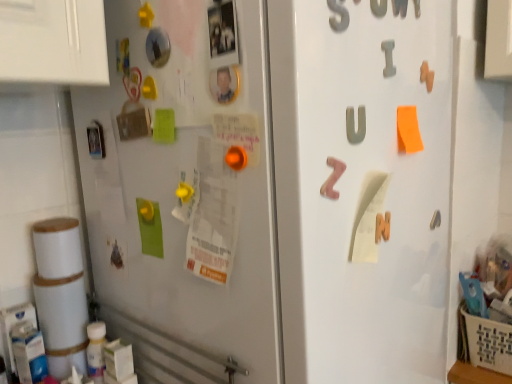
Where is `pink foam letter z at center, the third alphabet when ordered from top to bottom`? This screenshot has width=512, height=384. pink foam letter z at center, the third alphabet when ordered from top to bottom is located at coordinates (333, 178).

Where is `white paper at center right`? white paper at center right is located at coordinates click(x=368, y=217).

What do you see at coordinates (378, 7) in the screenshot? This screenshot has height=384, width=512. I see `metallic gray letter at upper center, positioned as the 2th number in left-to-right order` at bounding box center [378, 7].

Where is `beige woven basket at lower right`? beige woven basket at lower right is located at coordinates (484, 342).

How far apart are white paper at center right and gray matte letter i at upper right, acting as the third alphabet starting from the bottom?

They are 8.14 inches apart.

Is white paper at center right turned away from gray matte letter i at upper right, positioned as the 3th alphabet in front-to-back order?

No.

Can you confirm if white paper at center right is bigger than gray matte letter i at upper right, which is the third alphabet in left-to-right order?

Indeed, white paper at center right has a larger size compared to gray matte letter i at upper right, which is the third alphabet in left-to-right order.

Consider the image. Is there a large distance between white paper at center right and gray matte letter i at upper right, the first alphabet in the back-to-front sequence?

No, white paper at center right is not far away from gray matte letter i at upper right, the first alphabet in the back-to-front sequence.

Which object is further away from the camera, matte gray letter u at center, which is counted as the 2th alphabet, starting from the front, or pink foam letter z at center, the third alphabet when ordered from right to left?

matte gray letter u at center, which is counted as the 2th alphabet, starting from the front, is further from the camera.

Does matte gray letter u at center, the 2th alphabet ordered from the bottom, have a larger size compared to pink foam letter z at center, which is the third alphabet in back-to-front order?

Incorrect, matte gray letter u at center, the 2th alphabet ordered from the bottom, is not larger than pink foam letter z at center, which is the third alphabet in back-to-front order.

From a real-world perspective, who is located higher, matte gray letter u at center, which ranks as the 2th alphabet in right-to-left order, or pink foam letter z at center, the third alphabet when ordered from right to left?

From a 3D spatial view, matte gray letter u at center, which ranks as the 2th alphabet in right-to-left order, is above.

Considering the positions of point (349, 110) and point (370, 253), is point (349, 110) closer or farther from the camera than point (370, 253)?

Point (349, 110).

Is matte gray letter u at center, the second alphabet from the back, not near white paper at center right?

No.

Could you tell me if matte gray letter u at center, the 2th alphabet ordered from the bottom, is turned towards white paper at center right?

No, matte gray letter u at center, the 2th alphabet ordered from the bottom, is not oriented towards white paper at center right.

Image resolution: width=512 pixels, height=384 pixels. Identify the location of the 1st alphabet counting from the left side of the white paper at center right. (354, 125).

Considering the relative sizes of beige woven basket at lower right and pink foam letter z at center, which is the first alphabet in front-to-back order, in the image provided, is beige woven basket at lower right smaller than pink foam letter z at center, which is the first alphabet in front-to-back order,?

No.

Considering the relative positions of beige woven basket at lower right and pink foam letter z at center, the third alphabet when ordered from top to bottom, in the image provided, is beige woven basket at lower right to the left or to the right of pink foam letter z at center, the third alphabet when ordered from top to bottom,?

Based on their positions, beige woven basket at lower right is located to the right of pink foam letter z at center, the third alphabet when ordered from top to bottom.

Considering the relative sizes of beige woven basket at lower right and pink foam letter z at center, acting as the 1th alphabet starting from the left, in the image provided, is beige woven basket at lower right taller than pink foam letter z at center, acting as the 1th alphabet starting from the left,?

Yes.

Is beige woven basket at lower right facing towards pink foam letter z at center, which is the third alphabet in back-to-front order?

No, beige woven basket at lower right is not facing towards pink foam letter z at center, which is the third alphabet in back-to-front order.

Can you confirm if pink foam letter z at center, acting as the 1th alphabet starting from the left, is smaller than metallic gray letter at upper right, positioned as the second number in right-to-left order?

No.

Who is more distant, pink foam letter z at center, the third alphabet when ordered from right to left, or metallic gray letter at upper right, acting as the second number starting from the back?

pink foam letter z at center, the third alphabet when ordered from right to left, is further away from the camera.

Looking at this image, is pink foam letter z at center, which is the first alphabet in front-to-back order, positioned with its back to metallic gray letter at upper right, acting as the second number starting from the back?

No.

Considering the sizes of objects pink foam letter z at center, the third alphabet when ordered from right to left, and metallic gray letter at upper right, acting as the second number starting from the back, in the image provided, who is thinner, pink foam letter z at center, the third alphabet when ordered from right to left, or metallic gray letter at upper right, acting as the second number starting from the back,?

metallic gray letter at upper right, acting as the second number starting from the back.

Is beige woven basket at lower right wider or thinner than matte gray letter u at center, the second alphabet from the back?

In the image, beige woven basket at lower right appears to be wider than matte gray letter u at center, the second alphabet from the back.

Is beige woven basket at lower right taller than matte gray letter u at center, the second alphabet from the back?

Yes, beige woven basket at lower right is taller than matte gray letter u at center, the second alphabet from the back.

In the scene shown: Would you consider beige woven basket at lower right to be distant from matte gray letter u at center, the 2th alphabet ordered from the bottom?

beige woven basket at lower right is actually quite close to matte gray letter u at center, the 2th alphabet ordered from the bottom.

Image resolution: width=512 pixels, height=384 pixels. I want to click on the 2nd alphabet to the left of the beige woven basket at lower right, counting from the anchor's position, so click(x=354, y=125).

Is metallic gray letter at upper right, which is the 1th number in front-to-back order, bigger or smaller than matte gray letter u at center, which ranks as the 2th alphabet in right-to-left order?

In the image, metallic gray letter at upper right, which is the 1th number in front-to-back order, appears to be larger than matte gray letter u at center, which ranks as the 2th alphabet in right-to-left order.

Is metallic gray letter at upper right, the first number in the left-to-right sequence, with matte gray letter u at center, which is counted as the 2th alphabet, starting from the front?

metallic gray letter at upper right, the first number in the left-to-right sequence, and matte gray letter u at center, which is counted as the 2th alphabet, starting from the front, are not in contact.

Considering the positions of points (342, 20) and (359, 139), is point (342, 20) farther from camera compared to point (359, 139)?

No, it is in front of (359, 139).

From a real-world perspective, is metallic gray letter at upper right, acting as the second number starting from the back, beneath matte gray letter u at center, the 2th alphabet ordered from the bottom?

No, from a real-world perspective, metallic gray letter at upper right, acting as the second number starting from the back, is not under matte gray letter u at center, the 2th alphabet ordered from the bottom.

The image size is (512, 384). In order to click on the 2nd alphabet behind the white paper at center right in this screenshot , I will do `click(388, 58)`.

Find the location of a particular element. Image resolution: width=512 pixels, height=384 pixels. alphabet in front of the matte gray letter u at center, the second alphabet from the back is located at coordinates (333, 178).

Considering their positions, is metallic gray letter at upper center, which is the second number from front to back, positioned closer to metallic gray letter at upper right, which is the 1th number in front-to-back order, than matte gray letter u at center, which is counted as the 2th alphabet, starting from the front?

Based on the image, metallic gray letter at upper center, which is the second number from front to back, appears to be nearer to metallic gray letter at upper right, which is the 1th number in front-to-back order.

From the image, which object appears to be farther from matte gray letter u at center, which ranks as the 2th alphabet in right-to-left order, gray matte letter i at upper right, the first alphabet in the right-to-left sequence, or metallic gray letter at upper right, acting as the second number starting from the back?

metallic gray letter at upper right, acting as the second number starting from the back, is further to matte gray letter u at center, which ranks as the 2th alphabet in right-to-left order.

From the image, which object appears to be nearer to pink foam letter z at center, which is the third alphabet in back-to-front order, metallic gray letter at upper center, positioned as the 2th number in left-to-right order, or metallic gray letter at upper right, the first number in the left-to-right sequence?

The object closer to pink foam letter z at center, which is the third alphabet in back-to-front order, is metallic gray letter at upper right, the first number in the left-to-right sequence.

When comparing their distances from pink foam letter z at center, which is the third alphabet in back-to-front order, does gray matte letter i at upper right, the first alphabet in the back-to-front sequence, or metallic gray letter at upper center, the first number in the right-to-left sequence, seem closer?

Based on the image, gray matte letter i at upper right, the first alphabet in the back-to-front sequence, appears to be nearer to pink foam letter z at center, which is the third alphabet in back-to-front order.

Considering their positions, is white paper at center right positioned closer to beige woven basket at lower right than matte gray letter u at center, which is counted as the 2th alphabet, starting from the front?

white paper at center right.

Based on their spatial positions, is matte gray letter u at center, which ranks as the 2th alphabet in right-to-left order, or gray matte letter i at upper right, the first alphabet in the back-to-front sequence, closer to metallic gray letter at upper right, which is the 1th number in front-to-back order?

gray matte letter i at upper right, the first alphabet in the back-to-front sequence, is positioned closer to the anchor metallic gray letter at upper right, which is the 1th number in front-to-back order.

From the image, which object appears to be nearer to pink foam letter z at center, the first alphabet when ordered from bottom to top, metallic gray letter at upper center, which is the second number from front to back, or gray matte letter i at upper right, acting as the third alphabet starting from the bottom?

The object closer to pink foam letter z at center, the first alphabet when ordered from bottom to top, is gray matte letter i at upper right, acting as the third alphabet starting from the bottom.

When comparing their distances from metallic gray letter at upper center, which is the second number from front to back, does white paper at center right or metallic gray letter at upper right, which is the 1th number in front-to-back order, seem closer?

Among the two, metallic gray letter at upper right, which is the 1th number in front-to-back order, is located nearer to metallic gray letter at upper center, which is the second number from front to back.

Image resolution: width=512 pixels, height=384 pixels. Find the location of `number between metallic gray letter at upper center, positioned as the 2th number in left-to-right order, and matte gray letter u at center, which ranks as the 2th alphabet in right-to-left order, in the up-down direction`. number between metallic gray letter at upper center, positioned as the 2th number in left-to-right order, and matte gray letter u at center, which ranks as the 2th alphabet in right-to-left order, in the up-down direction is located at coordinates (338, 15).

Locate an element on the screen. This screenshot has height=384, width=512. alphabet between metallic gray letter at upper right, the first number in the left-to-right sequence, and matte gray letter u at center, the second alphabet from the back, vertically is located at coordinates (388, 58).

At what (x,y) coordinates should I click in order to perform the action: click on alphabet between metallic gray letter at upper center, the first number in the right-to-left sequence, and matte gray letter u at center, the second alphabet from the back, vertically. Please return your answer as a coordinate pair (x, y). The image size is (512, 384). Looking at the image, I should click on (388, 58).

Locate an element on the screen. paper between gray matte letter i at upper right, acting as the third alphabet starting from the bottom, and beige woven basket at lower right from top to bottom is located at coordinates (368, 217).